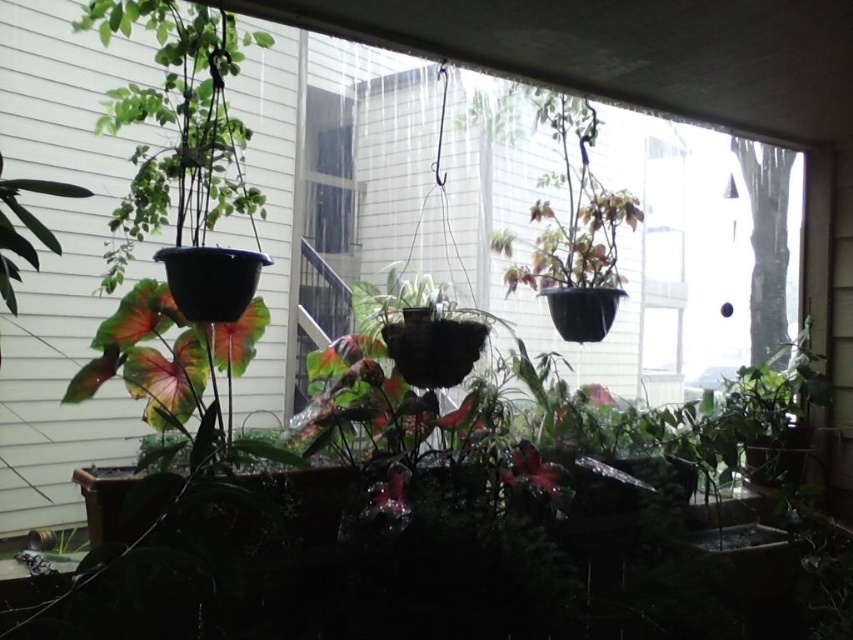
You are standing in the room looking through the window. There is a point marked at coordinates point (15,308). If you want to touch that point with a 4.5 feet long stick, can you reach it?

The point (15,308) is 4.01 feet away from the camera. Since the stick is 4.5 feet long, you can reach it.

You are standing in the room looking out the window. There is a point marked at coordinates [177,122]. What object is located at that point?

The point at coordinates [177,122] corresponds to the matte black pot at left.